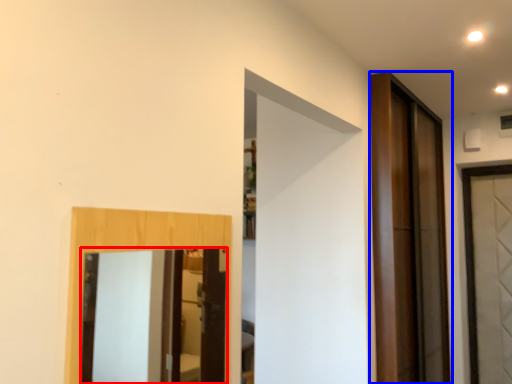
Question: Which object appears closest to the camera in this image, mirror (highlighted by a red box) or door (highlighted by a blue box)?

Choices:
 (A) mirror
 (B) door

Answer: (A)